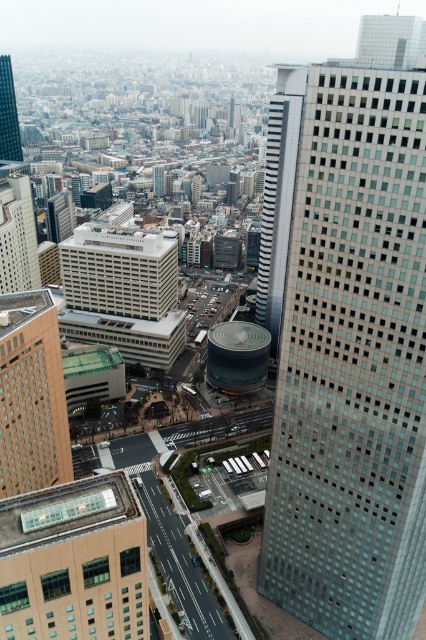
Can you confirm if glassy steel skyscraper at right is positioned above matte glass skyscraper at left?

Incorrect, glassy steel skyscraper at right is not positioned above matte glass skyscraper at left.

Can you confirm if glassy steel skyscraper at right is thinner than matte glass skyscraper at left?

No, glassy steel skyscraper at right is not thinner than matte glass skyscraper at left.

Is point (414, 573) closer to camera compared to point (22, 285)?

Yes, it is.

Find the location of `glassy steel skyscraper at right`. glassy steel skyscraper at right is located at coordinates (348, 337).

Is brown textured building at left smaller than matte glass skyscraper at left?

Indeed, brown textured building at left has a smaller size compared to matte glass skyscraper at left.

Between brown textured building at left and matte glass skyscraper at left, which one has less height?

With less height is brown textured building at left.

Is point (22, 477) more distant than point (16, 202)?

No.

At what (x,y) coordinates should I click in order to perform the action: click on brown textured building at left. Please return your answer as a coordinate pair (x, y). The image size is (426, 640). Looking at the image, I should click on point(31,396).

Which of these two, beige glass roof at center or matte glass skyscraper at left, stands shorter?

With less height is beige glass roof at center.

Between point (51, 570) and point (11, 225), which one is positioned in front?

Point (51, 570)

Which is behind, point (36, 548) or point (5, 211)?

Point (5, 211)

The height and width of the screenshot is (640, 426). What are the coordinates of `beige glass roof at center` in the screenshot? It's located at (74, 563).